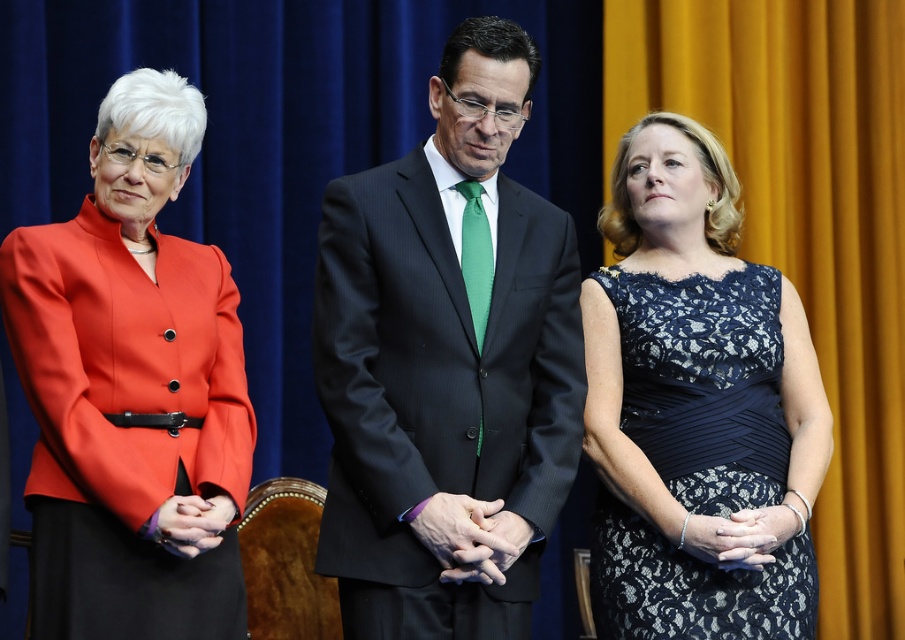
Question: Among these objects, which one is farthest from the camera?

Choices:
 (A) smooth skin hands at center
 (B) matte black hands at center
 (C) matte red jacket at left
 (D) dark blue pinstripe suit at center

Answer: (B)

Question: Does lace fabric dress at center appear under smooth skin hands at center?

Choices:
 (A) no
 (B) yes

Answer: (A)

Question: Which object is farther from the camera taking this photo?

Choices:
 (A) smooth skin hands at center
 (B) silver metallic bracelet at center
 (C) lace fabric dress at center

Answer: (C)

Question: Is matte red jacket at left positioned at the back of smooth skin hands at center?

Choices:
 (A) yes
 (B) no

Answer: (B)

Question: Can you confirm if matte red jacket at left is thinner than matte black hands at center?

Choices:
 (A) yes
 (B) no

Answer: (B)

Question: Which point is closer to the camera?

Choices:
 (A) silver metallic bracelet at center
 (B) lace fabric dress at center
 (C) smooth skin hands at center

Answer: (C)